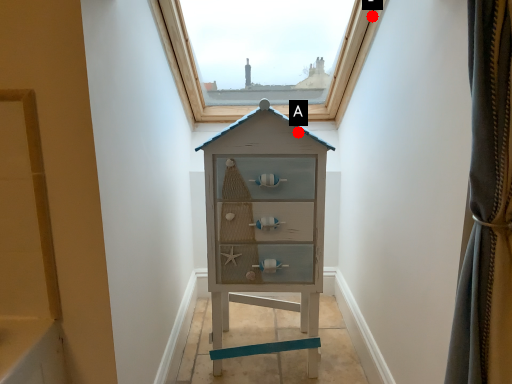
Question: Two points are circled on the image, labeled by A and B beside each circle. Which point appears farthest from the camera in this image?

Choices:
 (A) A is further
 (B) B is further

Answer: (B)